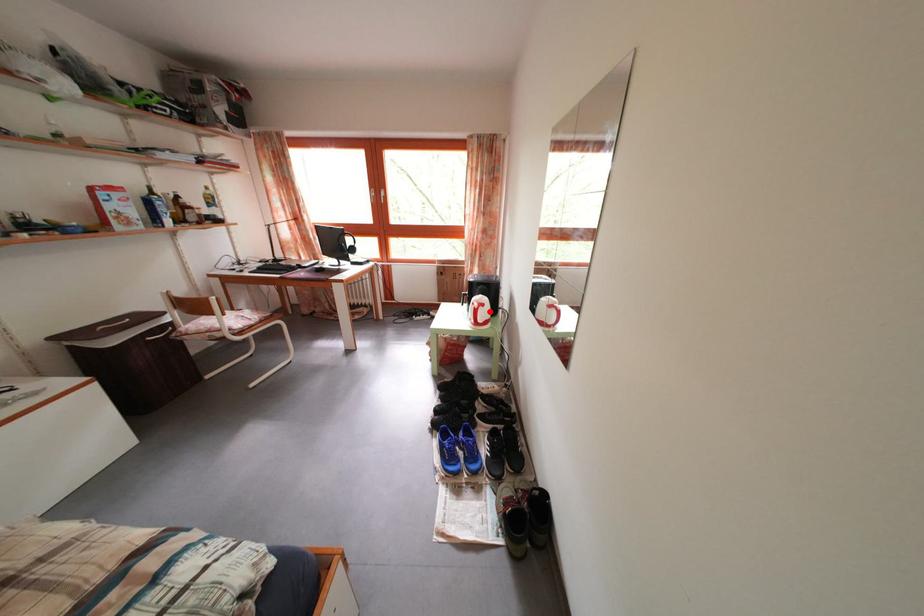
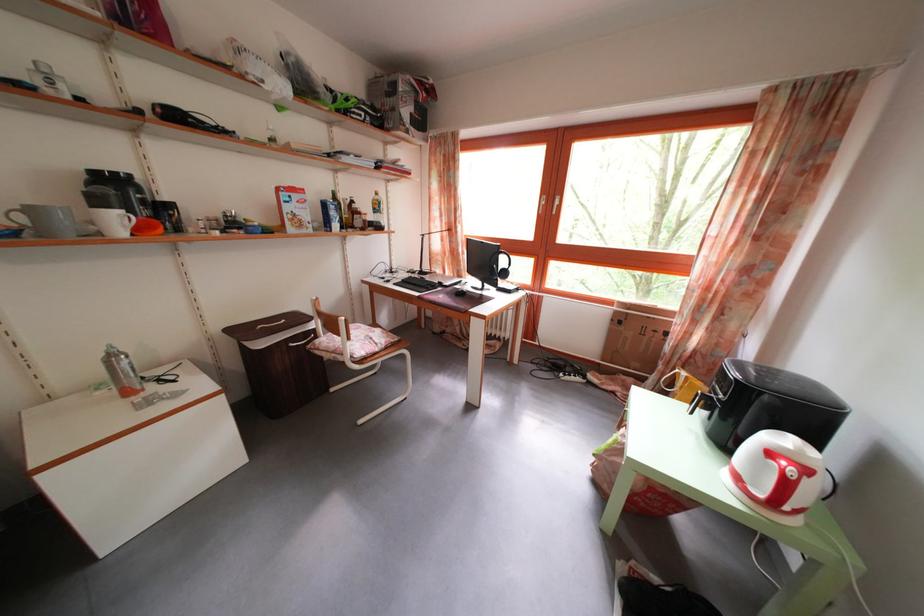
Question: I am providing you with two images of the same scene from different viewpoints. Image1 has a red point marked. In image2, the corresponding 3D location appears at what relative position? Reply with the corresponding letter.

Choices:
 (A) Closer
 (B) Farther

Answer: (A)